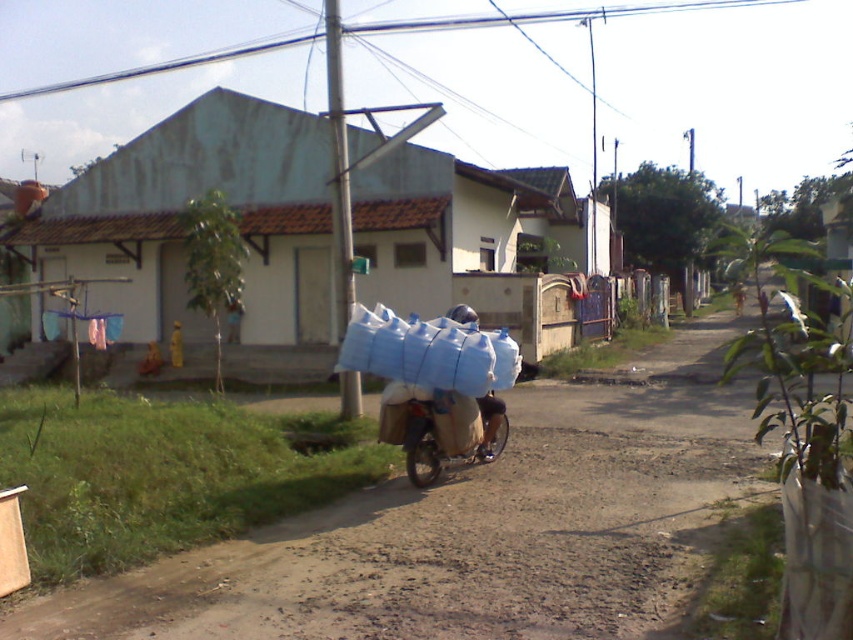
Question: Can you confirm if brown dirt track at center is positioned to the left of blue fabric bag at center?

Choices:
 (A) no
 (B) yes

Answer: (B)

Question: Can you confirm if brown dirt track at center is smaller than blue fabric bag at center?

Choices:
 (A) yes
 (B) no

Answer: (B)

Question: Can you confirm if brown dirt track at center is positioned above blue fabric bag at center?

Choices:
 (A) no
 (B) yes

Answer: (A)

Question: Which point is closer to the camera?

Choices:
 (A) (457, 305)
 (B) (183, 628)

Answer: (B)

Question: Which point appears closest to the camera in this image?

Choices:
 (A) (247, 637)
 (B) (488, 444)

Answer: (A)

Question: Which point appears closest to the camera in this image?

Choices:
 (A) (486, 419)
 (B) (434, 616)

Answer: (B)